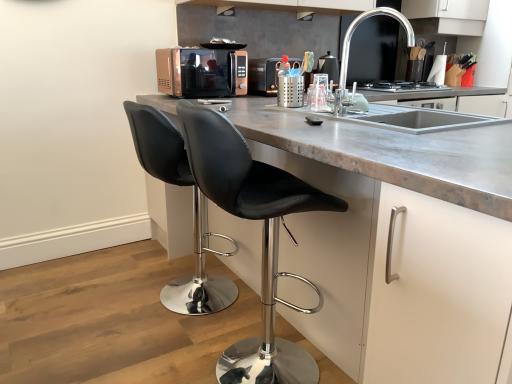
Question: Should I look upward or downward to see black leather stool at lower left, the second chair viewed from the front?

Choices:
 (A) down
 (B) up

Answer: (A)

Question: Is metallic microwave at center at the back of white matte cabinet at center?

Choices:
 (A) yes
 (B) no

Answer: (B)

Question: Is white matte cabinet at center wider than metallic microwave at center?

Choices:
 (A) no
 (B) yes

Answer: (B)

Question: Would you say white matte cabinet at center is a long distance from metallic microwave at center?

Choices:
 (A) yes
 (B) no

Answer: (A)

Question: Can you confirm if white matte cabinet at center is taller than metallic microwave at center?

Choices:
 (A) yes
 (B) no

Answer: (A)

Question: Does white matte cabinet at center have a lesser height compared to metallic microwave at center?

Choices:
 (A) no
 (B) yes

Answer: (A)

Question: Is white matte cabinet at center at the left side of metallic microwave at center?

Choices:
 (A) no
 (B) yes

Answer: (A)

Question: From a real-world perspective, is white matte cabinet at center physically above copper metallic microwave at center?

Choices:
 (A) no
 (B) yes

Answer: (A)

Question: Is white matte cabinet at center outside of copper metallic microwave at center?

Choices:
 (A) yes
 (B) no

Answer: (A)

Question: Is white matte cabinet at center wider than copper metallic microwave at center?

Choices:
 (A) no
 (B) yes

Answer: (B)

Question: Considering the relative positions of white matte cabinet at center and copper metallic microwave at center in the image provided, is white matte cabinet at center in front of copper metallic microwave at center?

Choices:
 (A) no
 (B) yes

Answer: (B)

Question: Is white matte cabinet at center looking in the opposite direction of copper metallic microwave at center?

Choices:
 (A) no
 (B) yes

Answer: (A)

Question: From the image's perspective, is white matte cabinet at center over copper metallic microwave at center?

Choices:
 (A) no
 (B) yes

Answer: (A)

Question: Is black leather stool at center, which ranks as the 2th chair in back-to-front order, directly adjacent to black leather stool at lower left, the second chair viewed from the front?

Choices:
 (A) yes
 (B) no

Answer: (B)